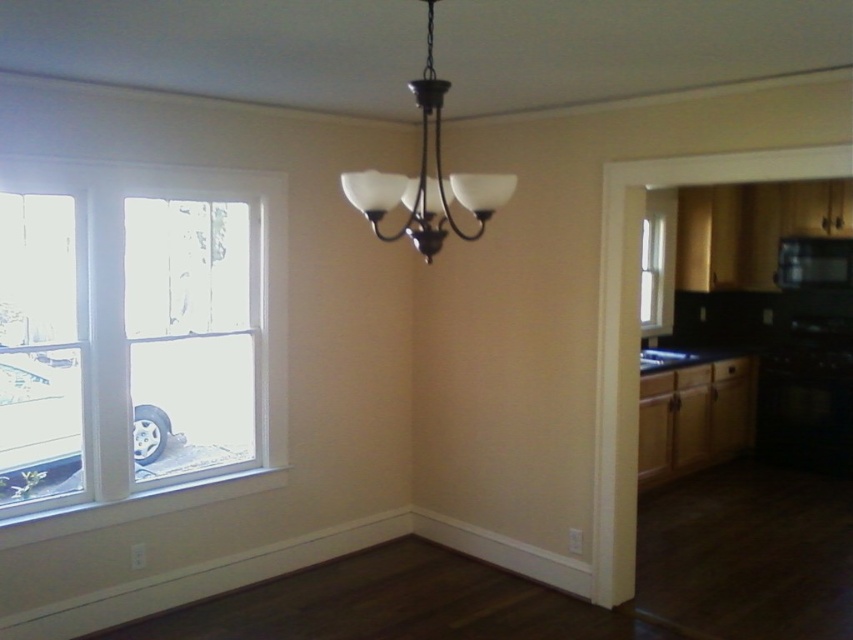
You are a delivery person trying to enter the house through the door located between the white glass window at left and the clear glass window at right. Can you fit through the doorway if your delivery cart is 3 meters wide?

The distance between the white glass window at left and the clear glass window at right is 3.67 meters. Since the delivery cart is 3 meters wide, it can fit through the doorway as the space is wider than the cart.

You are standing in the room and want to look outside through the white glass window at left. Based on its position, where should you stand to have the best view of the window?

The white glass window at left is located at point [138,330], so you should position yourself near the left side of the room to have the best view of the window.